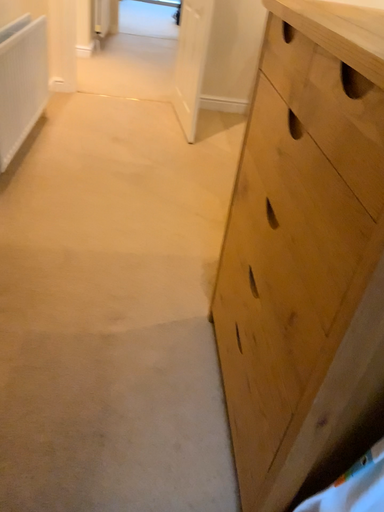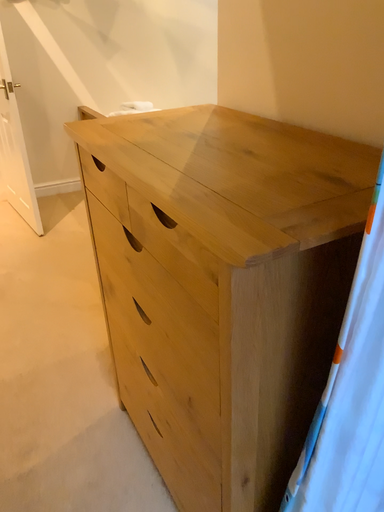
Question: How did the camera likely rotate when shooting the video?

Choices:
 (A) rotated right
 (B) rotated left

Answer: (A)